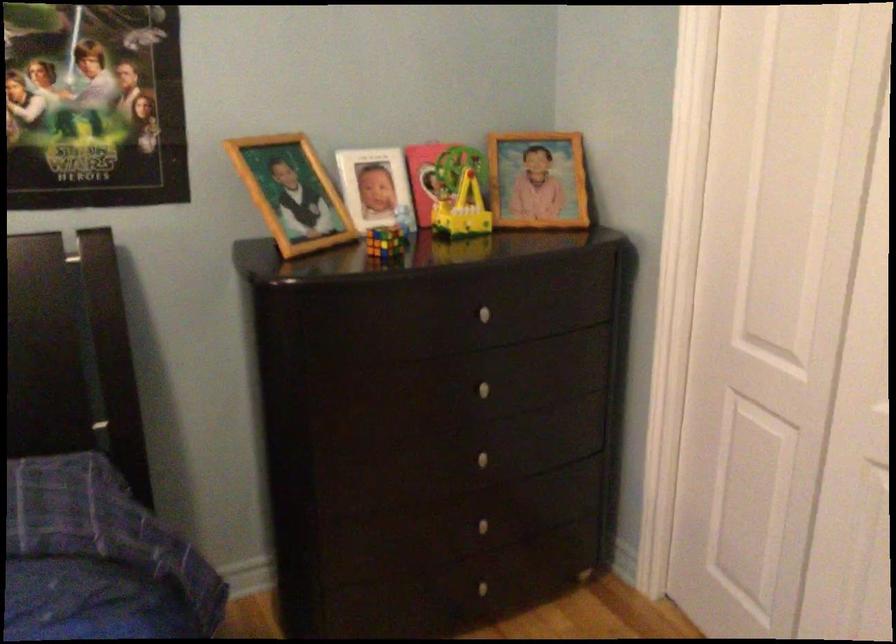
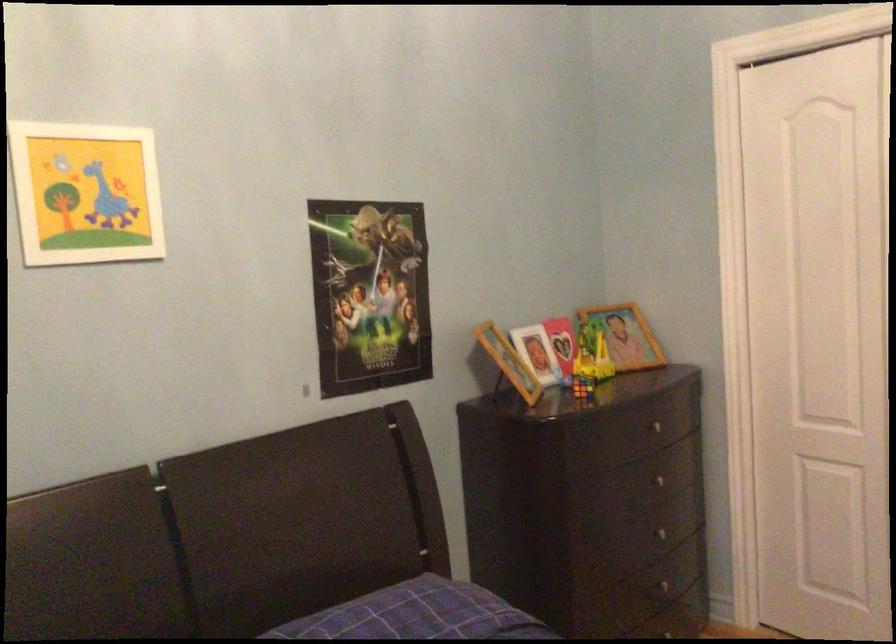
Consider the image. The images are taken continuously from a first-person perspective. In which direction are you moving?

The movement direction of the cameraman is left, backward.